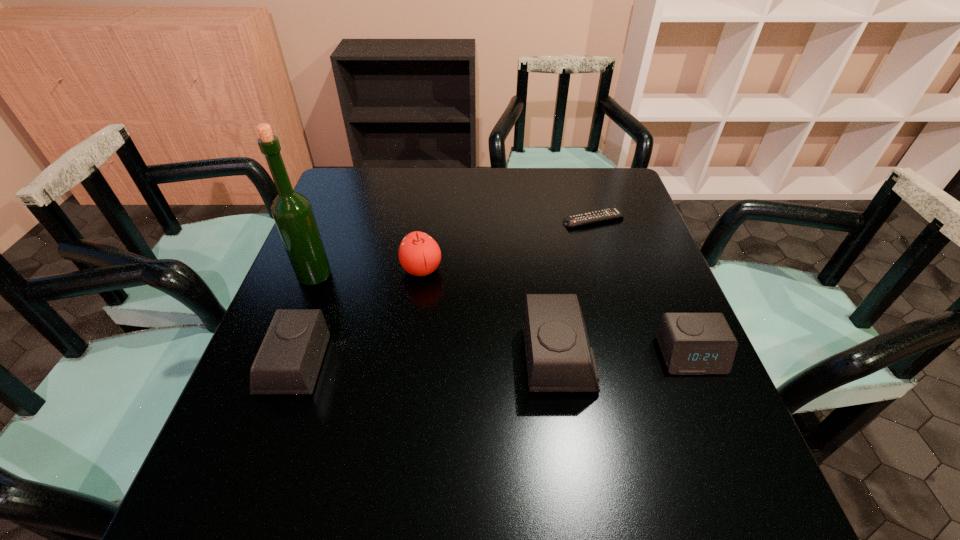
Image resolution: width=960 pixels, height=540 pixels. What are the coordinates of `the second shortest alarm clock` in the screenshot? It's located at (288, 362).

Locate an element on the screen. the second alarm clock from right to left is located at coordinates [x=559, y=358].

At what (x,y) coordinates should I click in order to perform the action: click on the fifth tallest object. Please return your answer as a coordinate pair (x, y). Looking at the image, I should click on (691, 343).

Where is `the shortest alarm clock`? This screenshot has width=960, height=540. the shortest alarm clock is located at coordinates (691, 343).

You are a GUI agent. You are given a task and a screenshot of the screen. Output one action in this format:
    pyautogui.click(x=<x>, y=<y>)
    Task: Click on the shortest object
    The image size is (960, 540).
    Given the screenshot: What is the action you would take?
    pyautogui.click(x=599, y=215)

Locate an element on the screen. The image size is (960, 540). the farthest object is located at coordinates (599, 215).

This screenshot has width=960, height=540. Find the location of `the third object from left to right`. the third object from left to right is located at coordinates (419, 254).

The width and height of the screenshot is (960, 540). Find the location of `liquor`. liquor is located at coordinates (292, 212).

Locate an element on the screen. vacant area situated 0.140m on the front-facing side of the fourth object from left to right is located at coordinates (660, 359).

The image size is (960, 540). In order to click on free space located 0.080m on the front-facing side of the shortest alarm clock in this screenshot , I will do `click(713, 412)`.